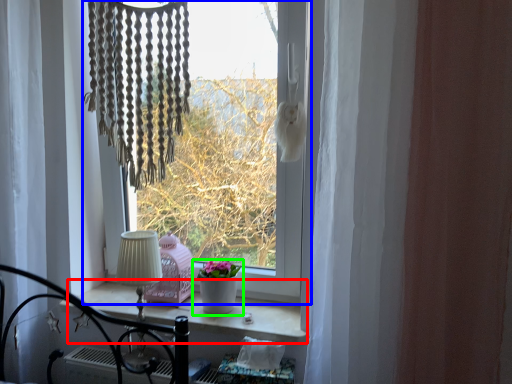
Question: Estimate the real-world distances between objects in this image. Which object is closer to window sill (highlighted by a red box), window (highlighted by a blue box) or houseplant (highlighted by a green box)?

Choices:
 (A) window
 (B) houseplant

Answer: (B)